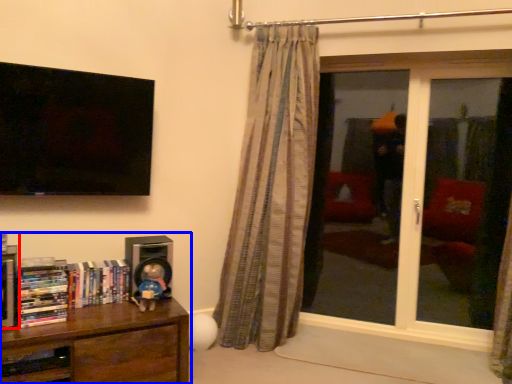
Question: Which object is further to the camera taking this photo, book (highlighted by a red box) or bookcase (highlighted by a blue box)?

Choices:
 (A) book
 (B) bookcase

Answer: (A)